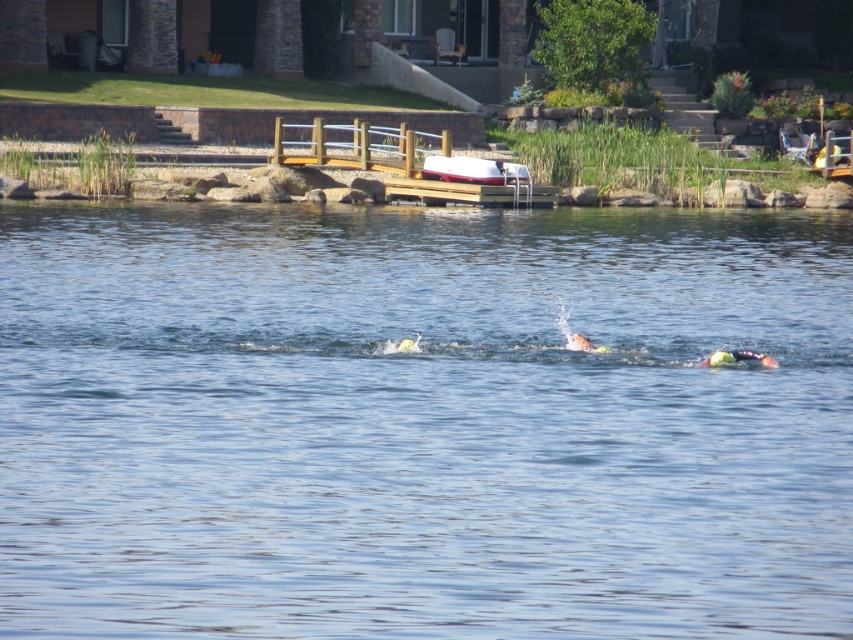
You are a swimmer trying to reach the dock from the clear blue water at center. Which direction should you swim to get closer to the dock?

The clear blue water at center is located at point (x=422, y=422), so you should swim towards the right to reach the dock.